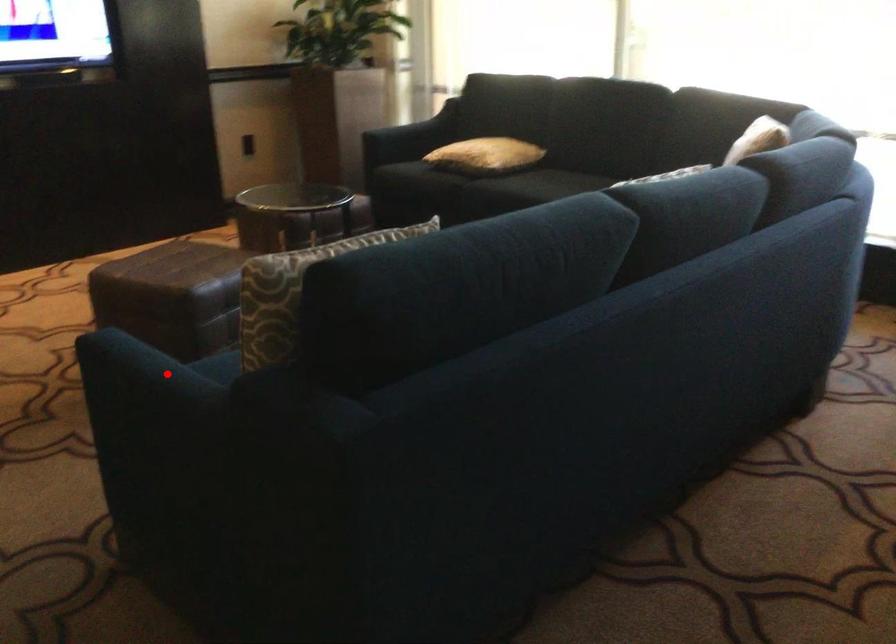
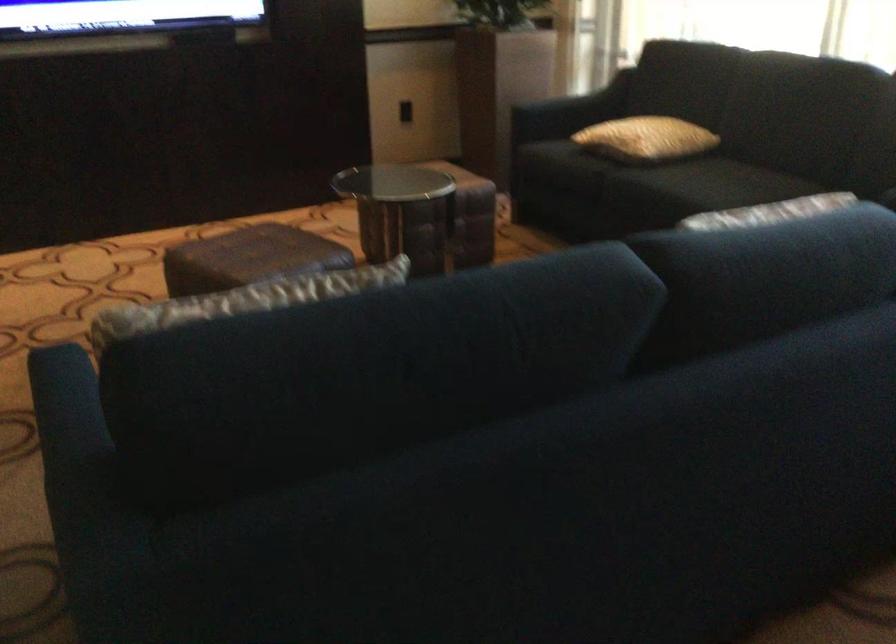
Question: I am providing you with two images of the same scene from different viewpoints. A red point is marked on the first image. Is the red point's position out of view in image 2?

Choices:
 (A) Yes
 (B) No

Answer: (B)